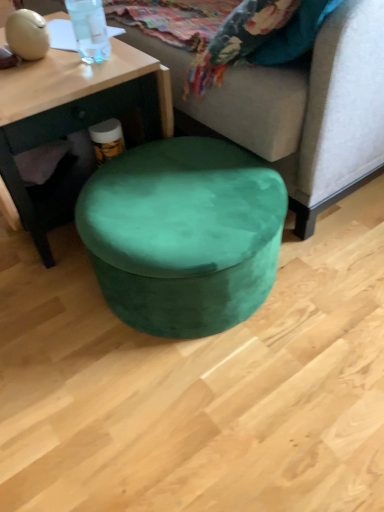
Where is `vacant region in front of matte wood coffee table at center`? The height and width of the screenshot is (512, 384). vacant region in front of matte wood coffee table at center is located at coordinates (61, 329).